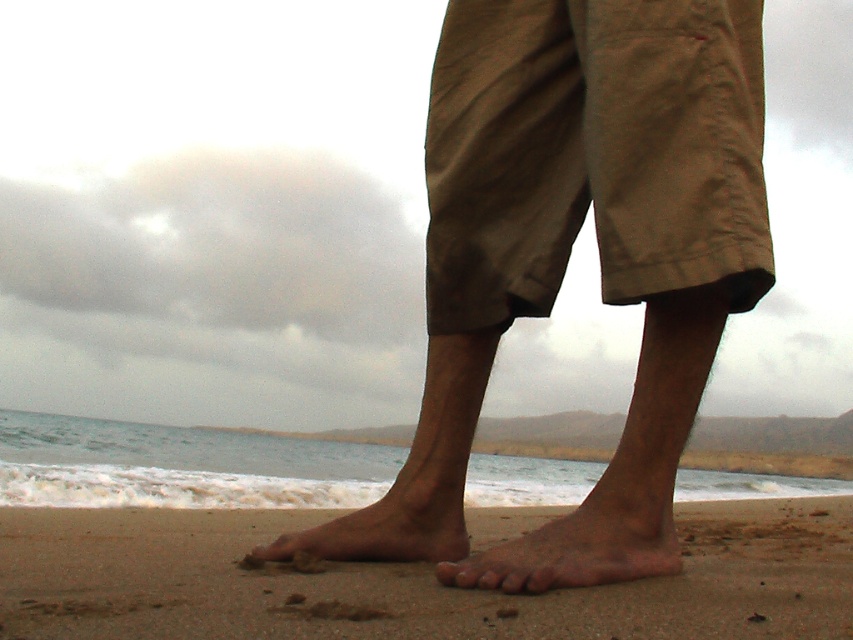
Between brown cotton shorts at center and dry skin foot at lower center, which one has more height?

Standing taller between the two is brown cotton shorts at center.

Is brown cotton shorts at center in front of dry skin foot at lower center?

No, it is not.

You are a GUI agent. You are given a task and a screenshot of the screen. Output one action in this format:
    pyautogui.click(x=<x>, y=<y>)
    Task: Click on the brown cotton shorts at center
    Image resolution: width=853 pixels, height=640 pixels.
    Given the screenshot: What is the action you would take?
    pyautogui.click(x=567, y=256)

Who is lower down, khaki cotton shorts at center or dry skin foot at lower center?

Positioned lower is dry skin foot at lower center.

Is khaki cotton shorts at center smaller than dry skin foot at lower center?

No, khaki cotton shorts at center is not smaller than dry skin foot at lower center.

In order to click on khaki cotton shorts at center in this screenshot , I will do `click(593, 154)`.

Is brown sand at lower center above brown matte skin at lower center?

No, brown sand at lower center is not above brown matte skin at lower center.

Between point (540, 600) and point (416, 508), which one is positioned in front?

Point (540, 600) is more forward.

At what (x,y) coordinates should I click in order to perform the action: click on brown sand at lower center. Please return your answer as a coordinate pair (x, y). Looking at the image, I should click on (410, 580).